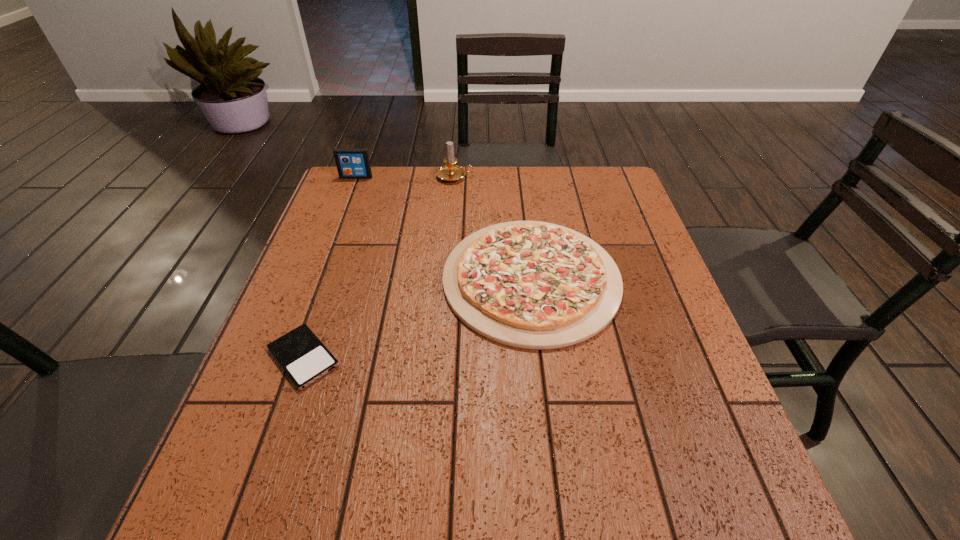
The height and width of the screenshot is (540, 960). What are the coordinates of `vacant region between the farther iPod and the candle` in the screenshot? It's located at (405, 177).

Identify the location of free space between the third tallest object and the third shortest object. This screenshot has height=540, width=960. (444, 228).

Identify the location of free point between the farther iPod and the shorter iPod. The height and width of the screenshot is (540, 960). (330, 267).

The width and height of the screenshot is (960, 540). What are the coordinates of `vacant space that is in between the shortest object and the farther iPod` in the screenshot? It's located at (330, 267).

Find the location of a particular element. Image resolution: width=960 pixels, height=540 pixels. free space between the nearer iPod and the tallest object is located at coordinates (379, 267).

Locate an element on the screen. empty space between the farther iPod and the second shortest object is located at coordinates (444, 228).

Select which object is the second closest to the taller iPod. Please provide its 2D coordinates. Your answer should be formatted as a tuple, i.e. [(x, y)], where the tuple contains the x and y coordinates of a point satisfying the conditions above.

[(535, 285)]

Identify which object is the nearest to the shortest object. Please provide its 2D coordinates. Your answer should be formatted as a tuple, i.e. [(x, y)], where the tuple contains the x and y coordinates of a point satisfying the conditions above.

[(535, 285)]

Identify the location of vacant space that satisfies the following two spatial constraints: 1. on the front screen of the third shortest object; 2. on the left side of the pizza. This screenshot has height=540, width=960. (318, 279).

Where is `vacant space that satisfies the following two spatial constraints: 1. on the front screen of the pizza; 2. on the left side of the third shortest object`? This screenshot has height=540, width=960. vacant space that satisfies the following two spatial constraints: 1. on the front screen of the pizza; 2. on the left side of the third shortest object is located at coordinates (318, 279).